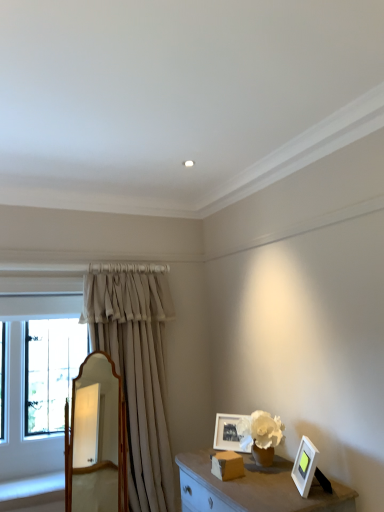
Question: Is beige fabric curtain at left positioned with its back to white matte picture frame at lower right, which appears as the second picture frame when viewed from the left?

Choices:
 (A) no
 (B) yes

Answer: (A)

Question: From a real-world perspective, is beige fabric curtain at left positioned over white matte picture frame at lower right, arranged as the second picture frame when viewed from the back, based on gravity?

Choices:
 (A) no
 (B) yes

Answer: (B)

Question: Can you confirm if beige fabric curtain at left is smaller than white matte picture frame at lower right, arranged as the second picture frame when viewed from the back?

Choices:
 (A) yes
 (B) no

Answer: (B)

Question: From a real-world perspective, is beige fabric curtain at left under white matte picture frame at lower right, the 1th picture frame from the front?

Choices:
 (A) yes
 (B) no

Answer: (B)

Question: Is beige fabric curtain at left far from white matte picture frame at lower right, the 1th picture frame in the right-to-left sequence?

Choices:
 (A) yes
 (B) no

Answer: (A)

Question: Is white matte picture frame at lower right, the 1th picture frame from the front, in front of or behind beige fabric curtain at left in the image?

Choices:
 (A) front
 (B) behind

Answer: (A)

Question: From the image's perspective, relative to beige fabric curtain at left, is white matte picture frame at lower right, the 1th picture frame from the front, above or below?

Choices:
 (A) below
 (B) above

Answer: (A)

Question: Looking at their shapes, would you say white matte picture frame at lower right, arranged as the second picture frame when viewed from the back, is wider or thinner than beige fabric curtain at left?

Choices:
 (A) thin
 (B) wide

Answer: (A)

Question: In terms of height, does white matte picture frame at lower right, which appears as the second picture frame when viewed from the left, look taller or shorter compared to beige fabric curtain at left?

Choices:
 (A) short
 (B) tall

Answer: (A)

Question: From the image's perspective, relative to white matte picture frame at lower right, which appears as the second picture frame when viewed from the left, is beige fabric curtain at left above or below?

Choices:
 (A) below
 (B) above

Answer: (B)

Question: Looking at the image, does beige fabric curtain at left seem bigger or smaller compared to white matte picture frame at lower right, arranged as the second picture frame when viewed from the back?

Choices:
 (A) small
 (B) big

Answer: (B)

Question: Visually, is beige fabric curtain at left positioned to the left or to the right of white matte picture frame at lower right, the 1th picture frame from the front?

Choices:
 (A) left
 (B) right

Answer: (A)

Question: Is beige fabric curtain at left taller or shorter than white matte picture frame at lower right, the 1th picture frame from the front?

Choices:
 (A) tall
 (B) short

Answer: (A)

Question: Is point (112, 486) closer or farther from the camera than point (165, 382)?

Choices:
 (A) closer
 (B) farther

Answer: (B)

Question: Considering the relative positions of wooden mirror at center and beige fabric curtain at left in the image provided, is wooden mirror at center to the left or to the right of beige fabric curtain at left?

Choices:
 (A) right
 (B) left

Answer: (B)